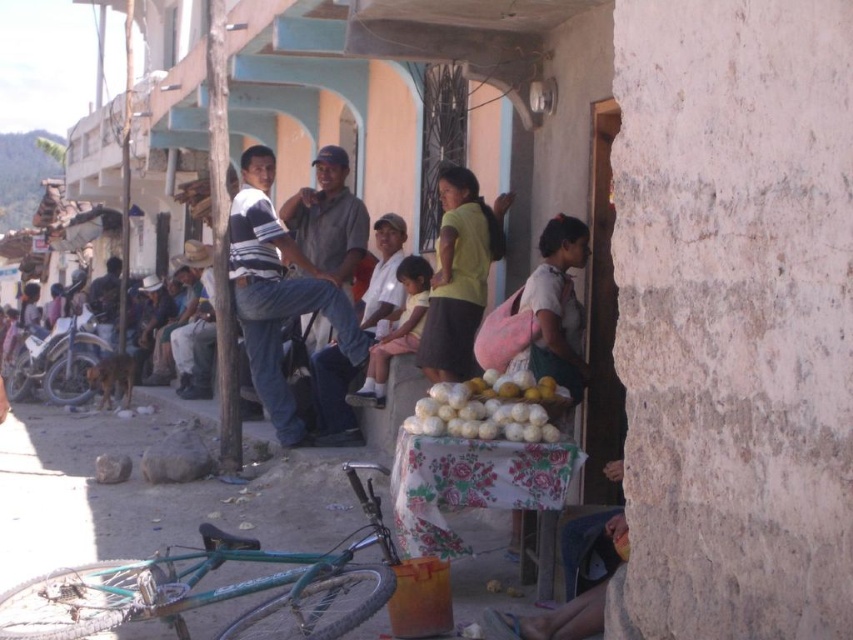
Question: Which point is closer to the camera taking this photo?

Choices:
 (A) (276, 420)
 (B) (459, 387)

Answer: (B)

Question: Which object appears closest to the camera in this image?

Choices:
 (A) white matte produce at center
 (B) denim jeans at center

Answer: (A)

Question: Where is denim jeans at center located in relation to white matte produce at center in the image?

Choices:
 (A) right
 (B) left

Answer: (B)

Question: Is denim jeans at center bigger than white matte produce at center?

Choices:
 (A) no
 (B) yes

Answer: (B)

Question: Which point is closer to the camera taking this photo?

Choices:
 (A) (465, 381)
 (B) (287, 401)

Answer: (A)

Question: Is denim jeans at center further to camera compared to white matte produce at center?

Choices:
 (A) yes
 (B) no

Answer: (A)